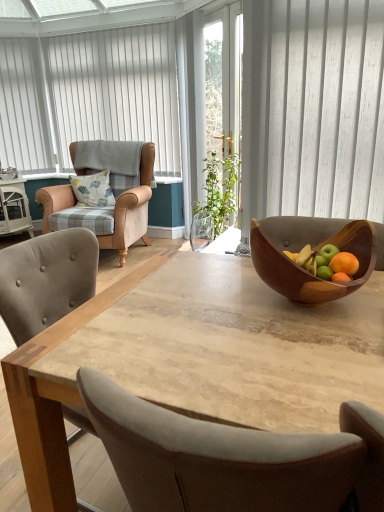
Where is `vacant point to the left of wooden bowl at center`? The height and width of the screenshot is (512, 384). vacant point to the left of wooden bowl at center is located at coordinates (210, 301).